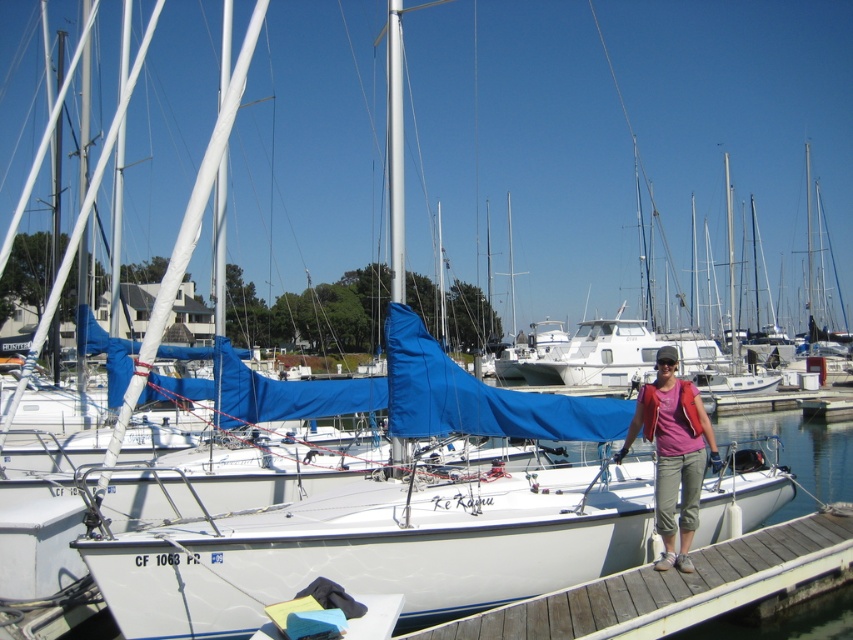
Can you confirm if wooden at lower right is wider than matte pink shirt at center?

Indeed, wooden at lower right has a greater width compared to matte pink shirt at center.

Is point (741, 570) less distant than point (685, 516)?

Yes, it is in front of point (685, 516).

Image resolution: width=853 pixels, height=640 pixels. In order to click on wooden at lower right in this screenshot , I will do `click(677, 588)`.